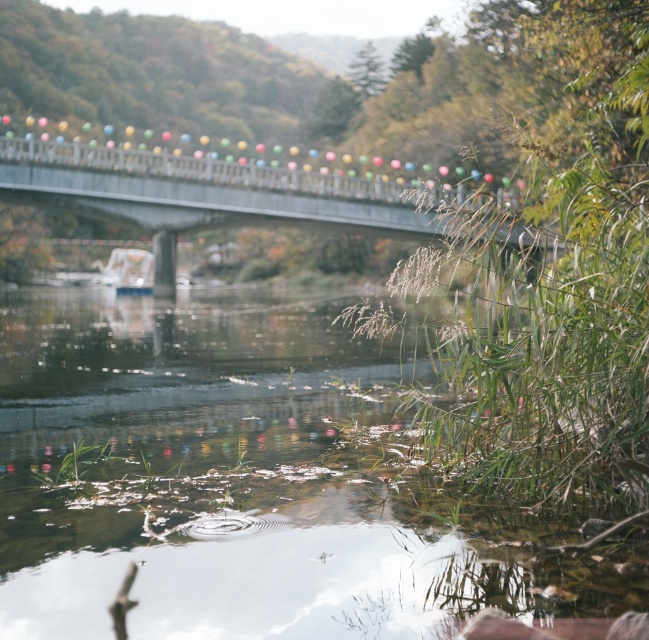
Question: From the image, what is the correct spatial relationship of translucent water at lower center in relation to concrete bridge at center?

Choices:
 (A) below
 (B) above

Answer: (A)

Question: Is concrete bridge at center further to camera compared to white plastic boat at center?

Choices:
 (A) yes
 (B) no

Answer: (B)

Question: Which point is farther to the camera?

Choices:
 (A) (371, 218)
 (B) (147, 257)
 (C) (334, 541)

Answer: (B)

Question: Which object is positioned farthest from the translucent water at lower center?

Choices:
 (A) white plastic boat at center
 (B) concrete bridge at center

Answer: (A)

Question: Does concrete bridge at center have a smaller size compared to white plastic boat at center?

Choices:
 (A) yes
 (B) no

Answer: (B)

Question: Which point appears closest to the camera in this image?

Choices:
 (A) (82, 499)
 (B) (127, 269)
 (C) (149, 202)

Answer: (A)